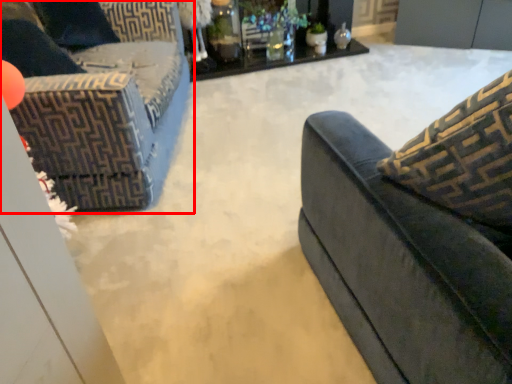
Question: Considering the relative positions of studio couch (annotated by the red box) and table in the image provided, where is studio couch (annotated by the red box) located with respect to the staircase?

Choices:
 (A) left
 (B) right

Answer: (A)